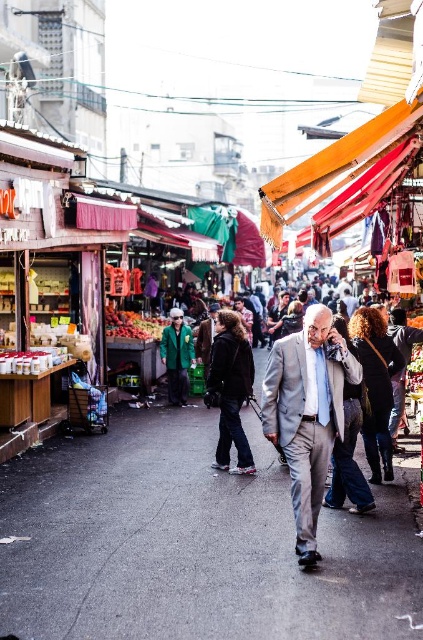
Question: Observing the image, what is the correct spatial positioning of gray suit at center in reference to green fabric jacket at center?

Choices:
 (A) right
 (B) left

Answer: (A)

Question: Among these points, which one is nearest to the camera?

Choices:
 (A) (313, 305)
 (B) (203, 580)
 (C) (183, 364)

Answer: (B)

Question: Among these points, which one is nearest to the camera?

Choices:
 (A) (326, 445)
 (B) (170, 348)
 (C) (178, 580)

Answer: (C)

Question: Which is farther from the gray suit at center?

Choices:
 (A) gray asphalt alley at center
 (B) green fabric jacket at center

Answer: (B)

Question: Does gray asphalt alley at center come behind gray suit at center?

Choices:
 (A) no
 (B) yes

Answer: (A)

Question: Is gray asphalt alley at center thinner than gray suit at center?

Choices:
 (A) yes
 (B) no

Answer: (B)